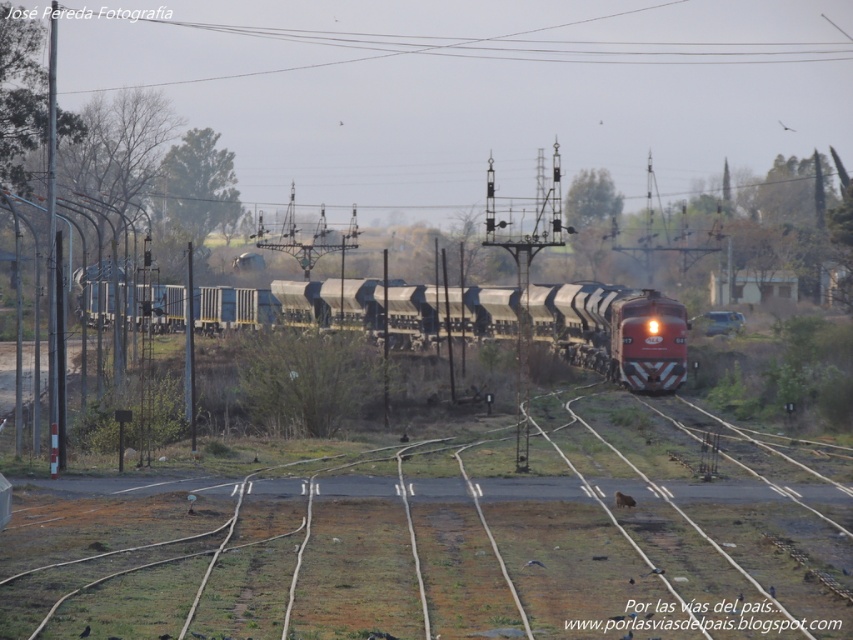
You are a photographer trying to capture the metallic freight train at center from above the brown dirt track at center. Can you position yourself so that the train is fully visible without any obstruction from the track?

The brown dirt track at center has a lesser height compared to the metallic freight train at center, so yes, you can position yourself above the track to fully see the metallic freight train at center without obstruction.

You are a train conductor observing the brown dirt track at center and the metallic freight train at center. Which object appears smaller in the image?

The brown dirt track at center is smaller than the metallic freight train at center.

You are standing at the edge of the scene and want to cross the brown dirt track at center. Is the metallic freight train at center currently blocking your path?

The brown dirt track at center is in front of the metallic freight train at center, meaning the train is behind the track. Therefore, the metallic freight train at center is not blocking your path to cross the brown dirt track at center.